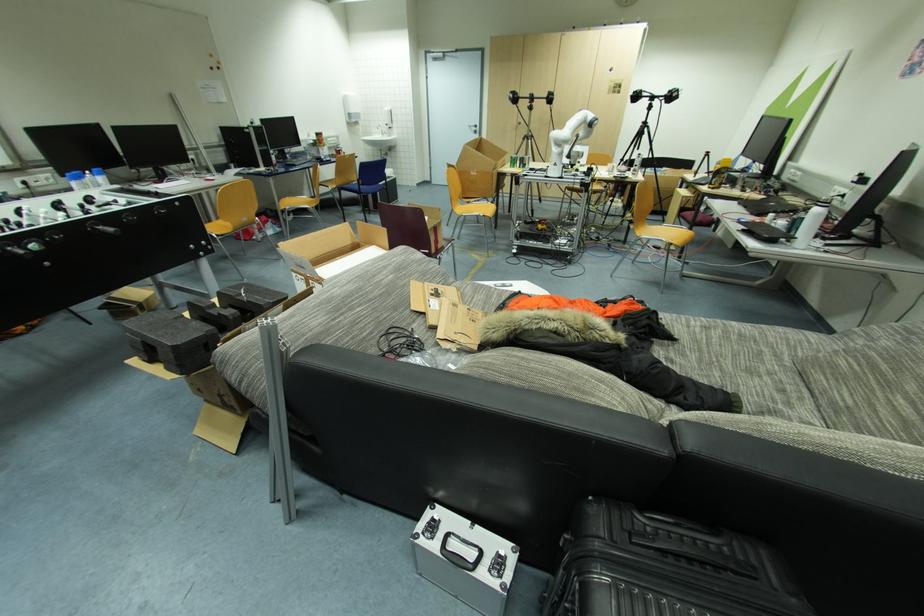
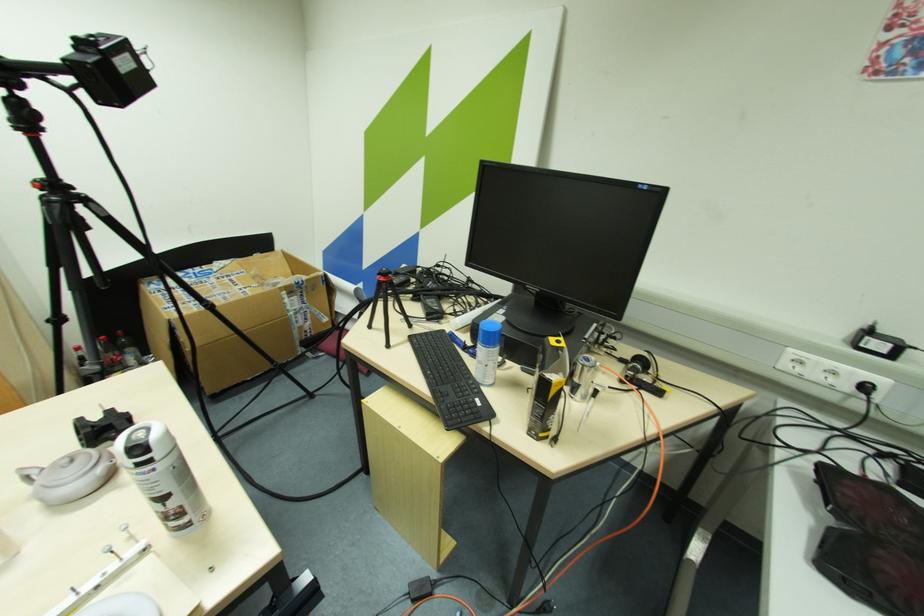
In the second image, find the point that corresponds to [638,167] in the first image.

(164, 500)